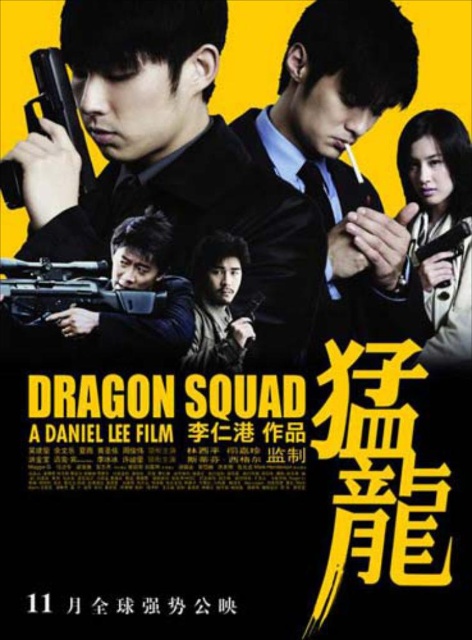
Question: Does matte black gun at center appear on the left side of matte black sniper rifle at center?

Choices:
 (A) yes
 (B) no

Answer: (B)

Question: Does matte black sniper rifle at center appear on the right side of polished silver pistol at upper left?

Choices:
 (A) no
 (B) yes

Answer: (B)

Question: Estimate the real-world distances between objects in this image. Which object is closer to the matte black suit at center?

Choices:
 (A) matte black sniper rifle at center
 (B) dark brown leather jacket at center
 (C) matte black gun at upper right

Answer: (C)

Question: Is matte black gun at upper right smaller than dark brown leather jacket at center?

Choices:
 (A) no
 (B) yes

Answer: (A)

Question: Which object is the farthest from the matte black sniper rifle at center?

Choices:
 (A) matte black gun at upper right
 (B) matte black suit at center
 (C) polished silver pistol at upper left
 (D) dark brown leather jacket at center

Answer: (A)

Question: Which object appears closest to the camera in this image?

Choices:
 (A) dark brown leather jacket at center
 (B) matte black suit at center
 (C) polished silver pistol at upper left
 (D) matte black gun at upper right

Answer: (C)